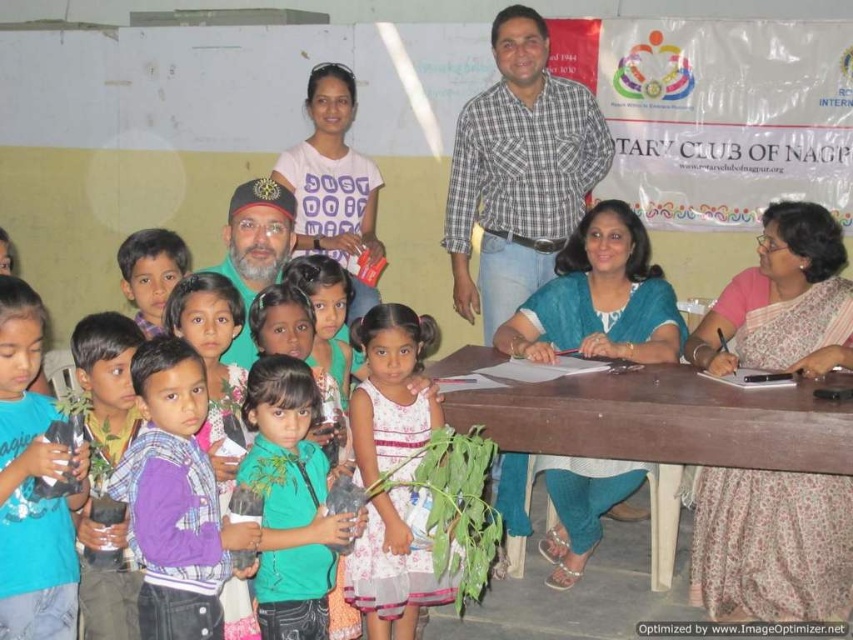
Question: Which of the following is the farthest from the observer?

Choices:
 (A) purple cotton shirt at left
 (B) wooden table at lower center

Answer: (B)

Question: Can you confirm if purple cotton shirt at left is smaller than matte green shirt at center?

Choices:
 (A) yes
 (B) no

Answer: (B)

Question: Which point is closer to the camera?

Choices:
 (A) purple cotton shirt at center
 (B) purple cotton shirt at left

Answer: (A)

Question: Which point appears farthest from the camera in this image?

Choices:
 (A) (86, 534)
 (B) (154, 285)

Answer: (B)

Question: Is blue matte plant at center wider than matte green shirt at center?

Choices:
 (A) no
 (B) yes

Answer: (B)

Question: Is green matte shirt at center bigger than matte green shirt at center?

Choices:
 (A) no
 (B) yes

Answer: (B)